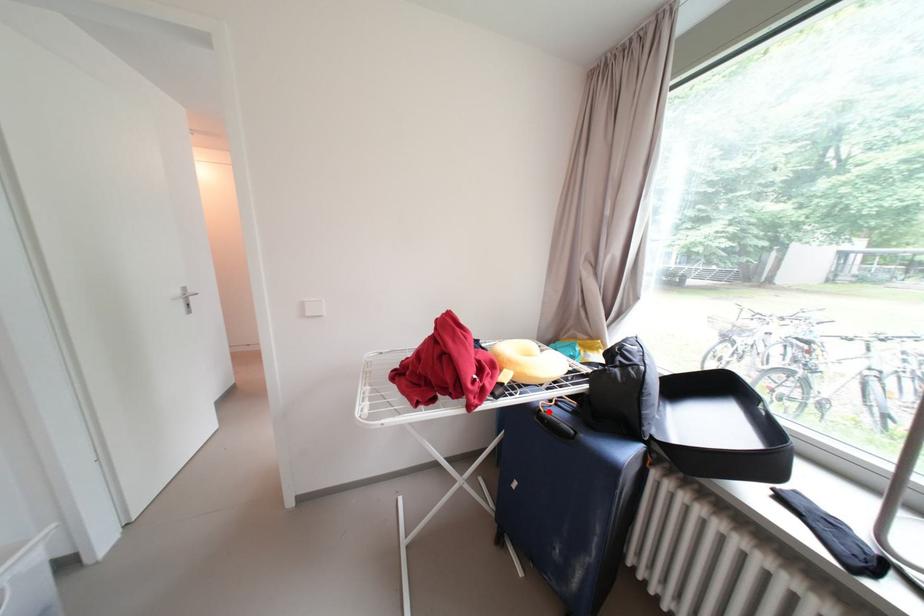
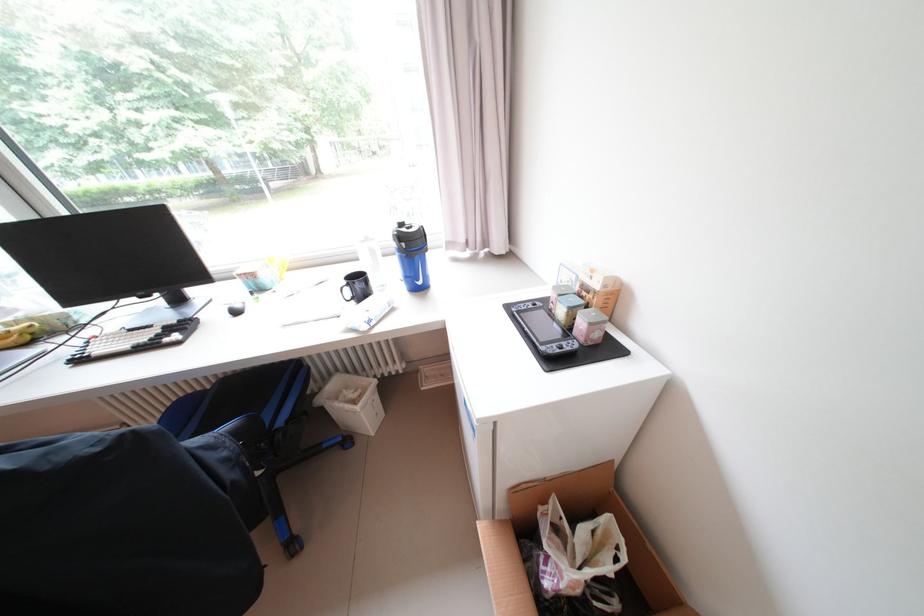
Question: I am providing you with two images of the same scene from different viewpoints. A red point is marked on the first image. Is the red point's position out of view in image 2?

Choices:
 (A) Yes
 (B) No

Answer: (A)